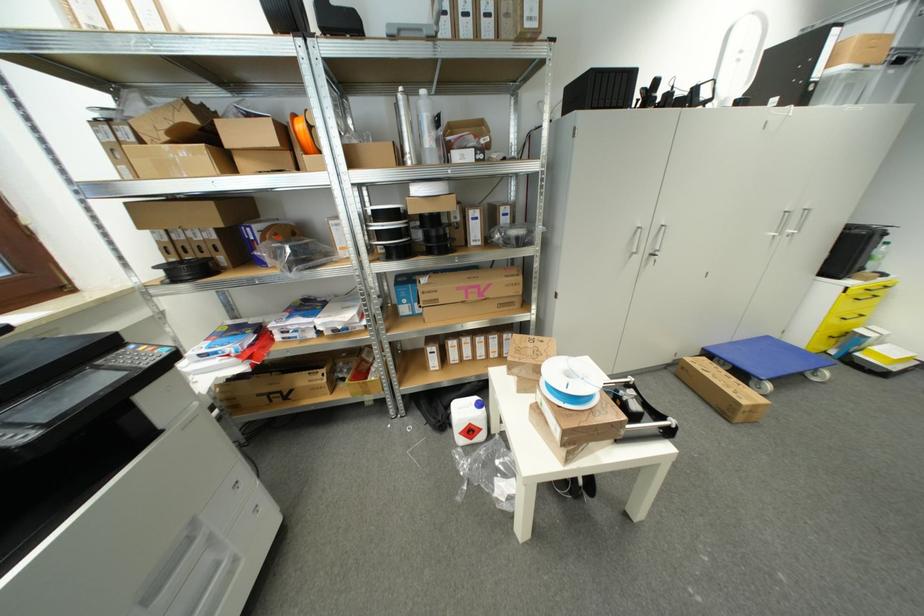
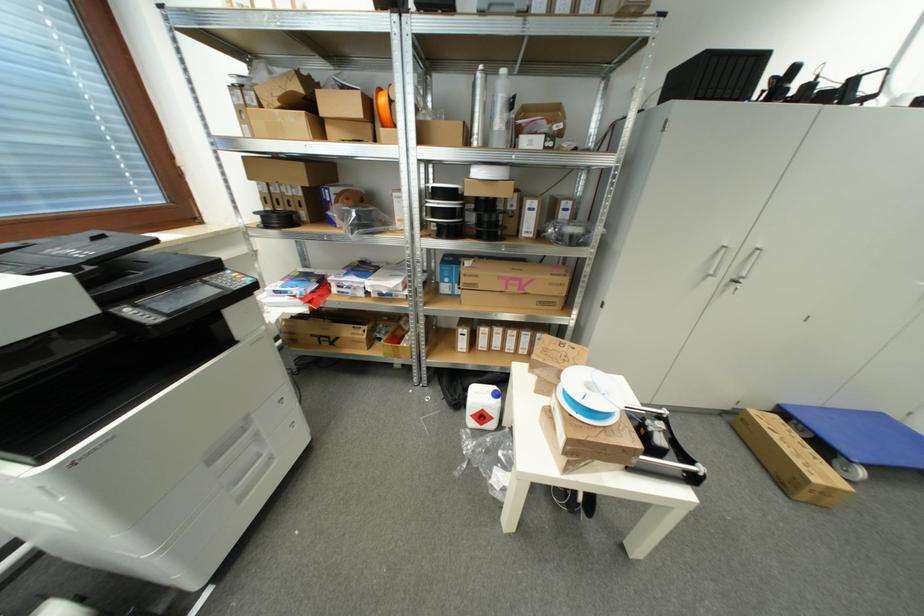
Where in the second image is the point corresponding to [433,143] from the first image?

(504, 126)